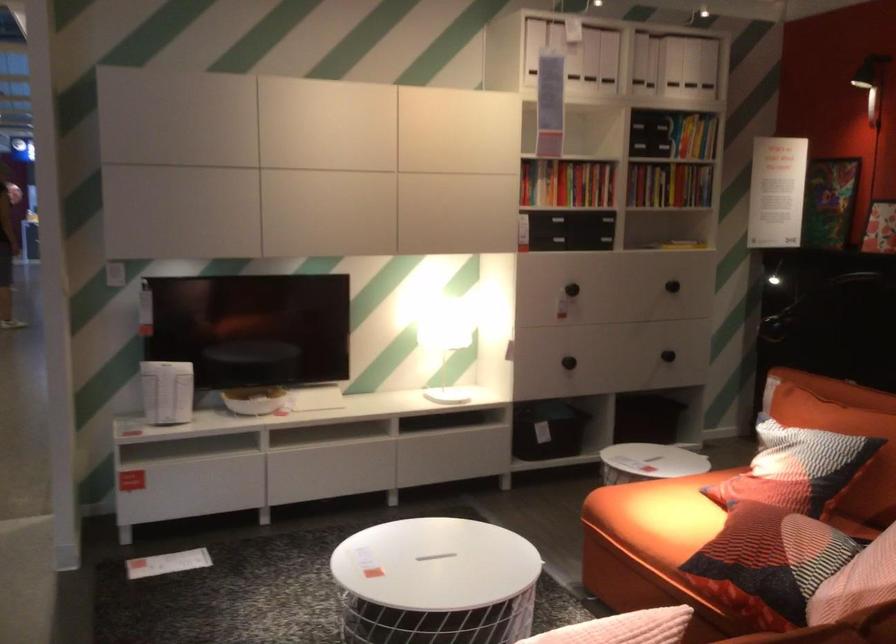
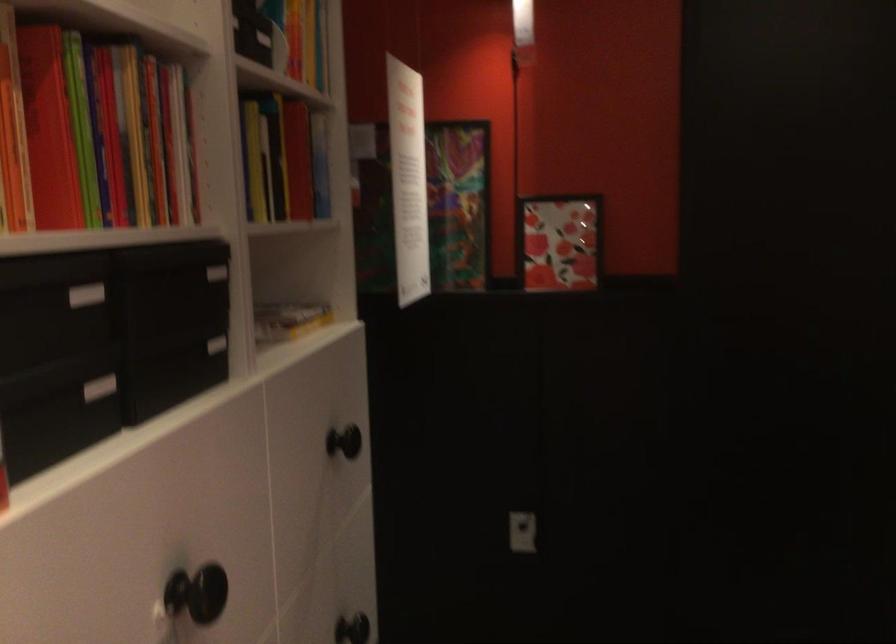
Locate, in the second image, the point that corresponds to point 624,190 in the first image.

(216, 272)